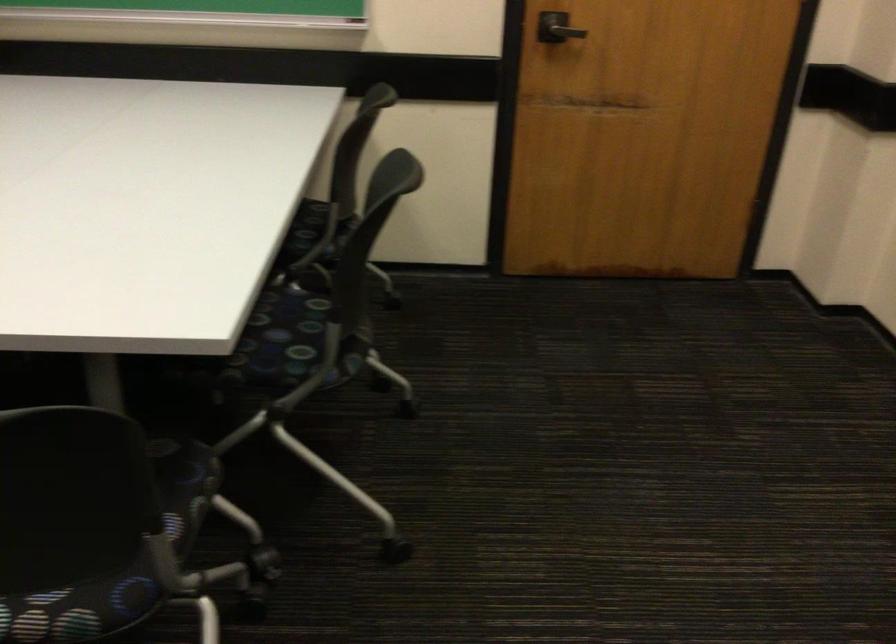
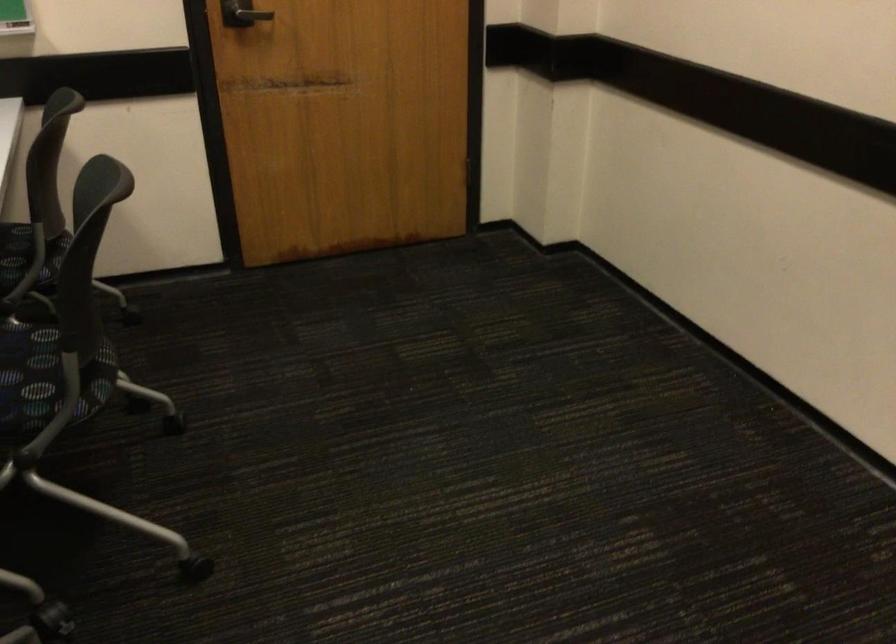
The point at (298,343) is marked in the first image. Where is the corresponding point in the second image?

(47, 374)